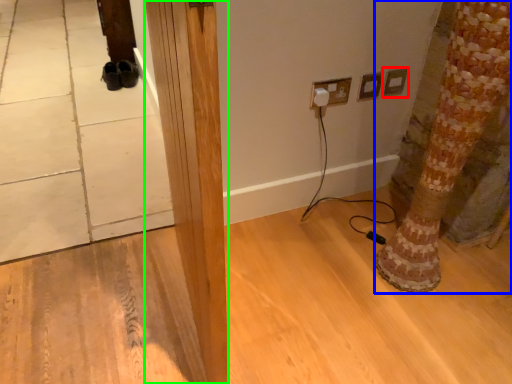
Question: Considering the real-world distances, which object is closest to electric outlet (highlighted by a red box)? tree trunk (highlighted by a blue box) or pillar (highlighted by a green box).

Choices:
 (A) tree trunk
 (B) pillar

Answer: (A)